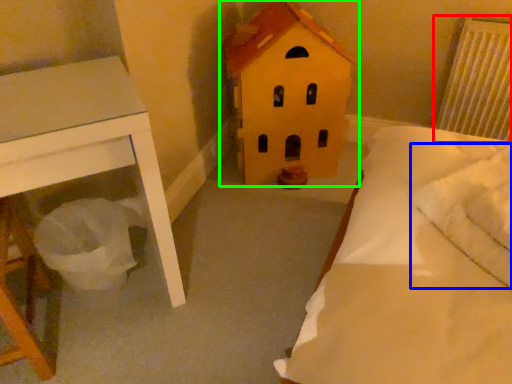
Question: Which is farther away from radiator (highlighted by a red box)? pillow (highlighted by a blue box) or toy (highlighted by a green box)?

Choices:
 (A) pillow
 (B) toy

Answer: (A)